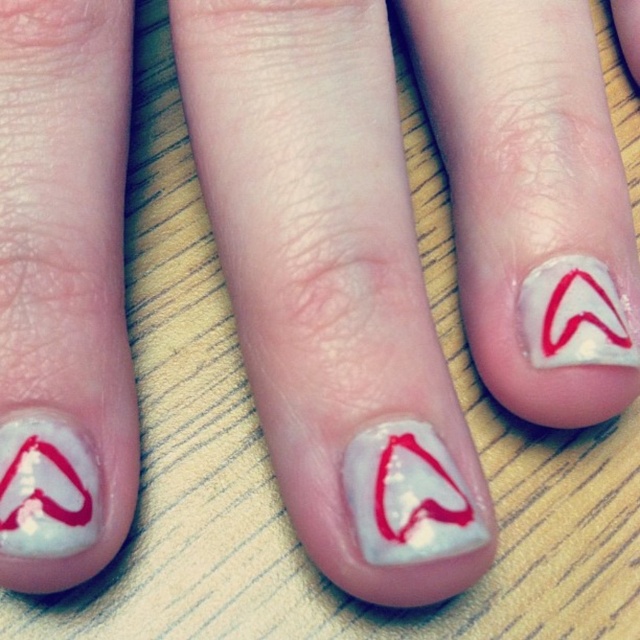
In order to click on white glossy nail at center in this screenshot , I will do `click(64, 292)`.

Does white glossy nail art at center appear on the right side of white glossy heart at upper right?

No, white glossy nail art at center is not to the right of white glossy heart at upper right.

Which is above, white glossy nail art at center or white glossy heart at upper right?

white glossy nail art at center is higher up.

I want to click on white glossy nail art at center, so click(321, 259).

Who is more distant from viewer, [348,310] or [58,460]?

The point [348,310] is more distant.

Between point (408, 22) and point (28, 448), which one is positioned in front?

Point (28, 448) is in front.

Is point (582, 161) farther from camera compared to point (8, 516)?

Yes.

Locate an element on the screen. This screenshot has height=640, width=640. white glossy nail art at center is located at coordinates (321, 259).